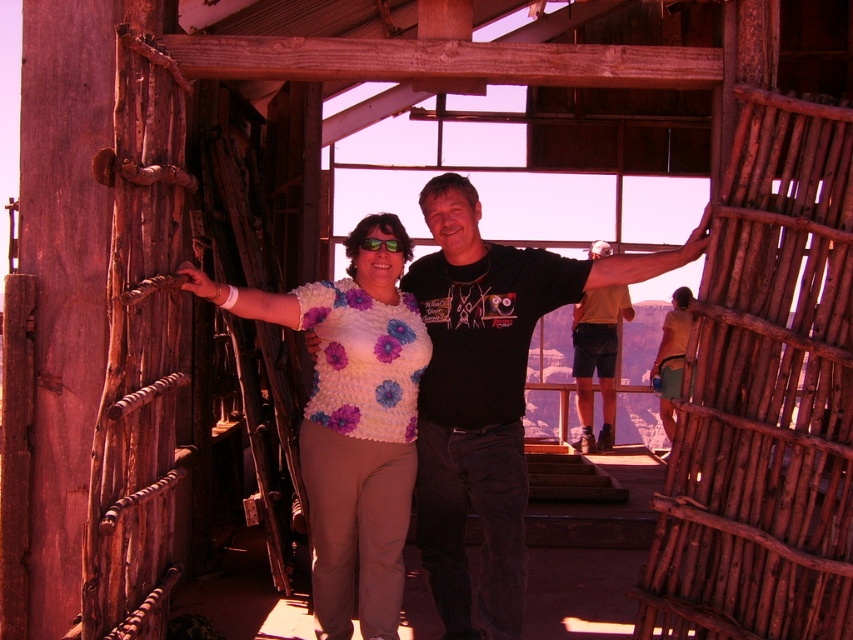
Question: Which point appears closest to the camera in this image?

Choices:
 (A) (599, 243)
 (B) (508, 627)

Answer: (B)

Question: Is matte yellow t-shirt at center above black matte arm at upper right?

Choices:
 (A) no
 (B) yes

Answer: (A)

Question: Based on their relative distances, which object is farther from the brown fabric shirt at right?

Choices:
 (A) matte yellow t-shirt at center
 (B) green reflective lenses at center

Answer: (B)

Question: Observing the image, what is the correct spatial positioning of matte yellow t-shirt at center in reference to green reflective lenses at center?

Choices:
 (A) left
 (B) right

Answer: (B)

Question: Which point is farther to the camera?

Choices:
 (A) pyautogui.click(x=635, y=260)
 (B) pyautogui.click(x=573, y=330)

Answer: (B)

Question: Is fluffy white sweater at center below green reflective lenses at center?

Choices:
 (A) yes
 (B) no

Answer: (A)